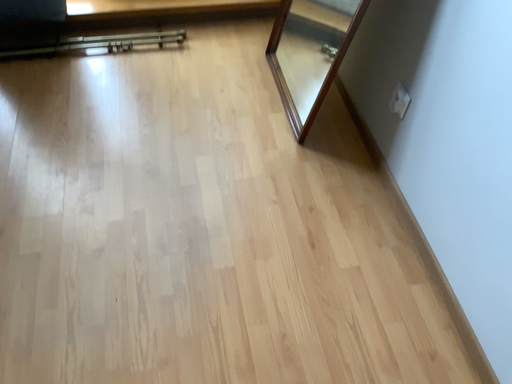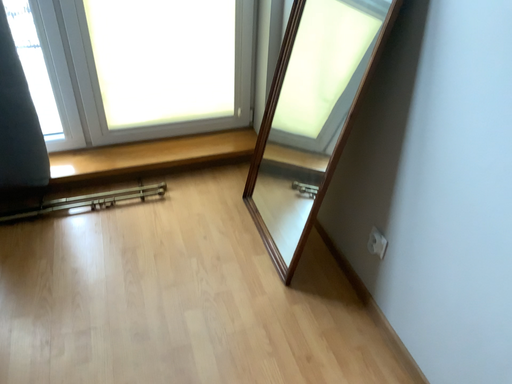
Question: Which way did the camera rotate in the video?

Choices:
 (A) rotated downward
 (B) rotated upward

Answer: (B)